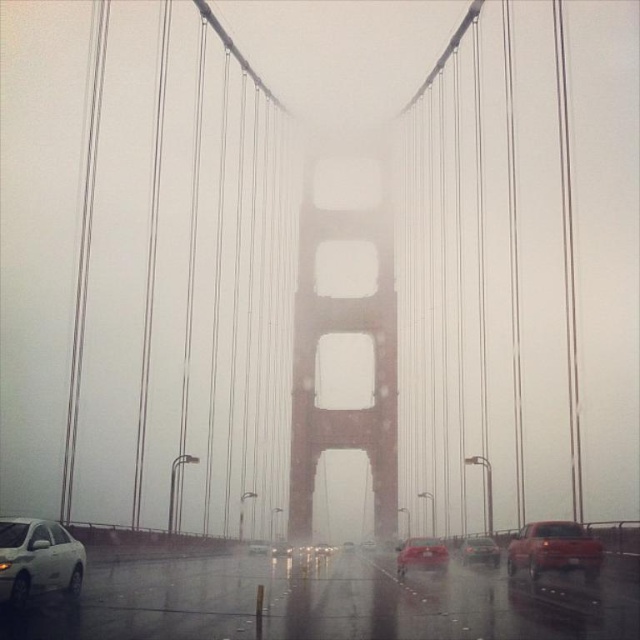
Question: Does metallic silver sedan at lower right lie behind metallic silver sedan at center?

Choices:
 (A) yes
 (B) no

Answer: (B)

Question: Which object is closer to the camera taking this photo?

Choices:
 (A) white glossy sedan at lower left
 (B) shiny red sedan at center
 (C) metallic silver car at center

Answer: (A)

Question: Is shiny red sedan at center thinner than metallic silver car at center?

Choices:
 (A) no
 (B) yes

Answer: (A)

Question: Is brick textured tower at center behind matte red truck at right?

Choices:
 (A) yes
 (B) no

Answer: (A)

Question: Which object appears farthest from the camera in this image?

Choices:
 (A) matte red truck at right
 (B) brick textured tower at center
 (C) shiny red sedan at center
 (D) white glossy sedan at lower left

Answer: (B)

Question: Which point is farther to the camera?

Choices:
 (A) metallic silver sedan at center
 (B) matte red truck at right
 (C) brick textured tower at center
 (D) metallic silver car at center

Answer: (C)